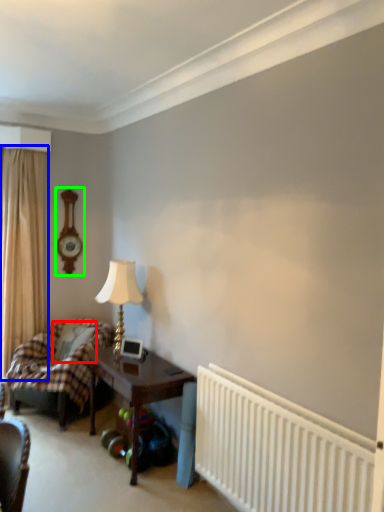
Question: Which object is positioned closest to pillow (highlighted by a red box)? Select from curtain (highlighted by a blue box) and clock (highlighted by a green box).

Choices:
 (A) curtain
 (B) clock

Answer: (A)